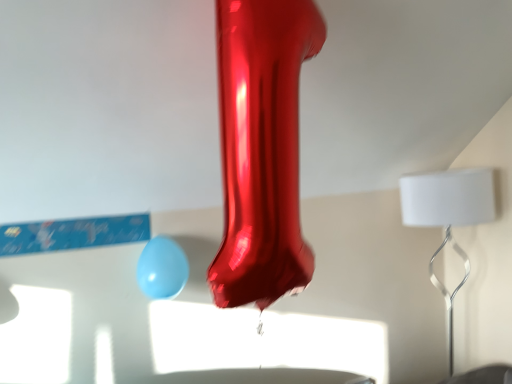
Question: From the image's perspective, relative to white matte lampshade at right, is matte blue balloon at lower center above or below?

Choices:
 (A) below
 (B) above

Answer: (B)

Question: Considering their positions, is matte blue balloon at lower center located in front of or behind white matte lampshade at right?

Choices:
 (A) front
 (B) behind

Answer: (A)

Question: Is matte blue balloon at lower center taller or shorter than white matte lampshade at right?

Choices:
 (A) tall
 (B) short

Answer: (B)

Question: Relative to matte blue balloon at lower center, is white matte lampshade at right in front or behind?

Choices:
 (A) front
 (B) behind

Answer: (B)

Question: From a real-world perspective, is white matte lampshade at right physically located above or below matte blue balloon at lower center?

Choices:
 (A) below
 (B) above

Answer: (A)

Question: Is white matte lampshade at right taller or shorter than matte blue balloon at lower center?

Choices:
 (A) short
 (B) tall

Answer: (B)

Question: In terms of size, does white matte lampshade at right appear bigger or smaller than matte blue balloon at lower center?

Choices:
 (A) big
 (B) small

Answer: (A)